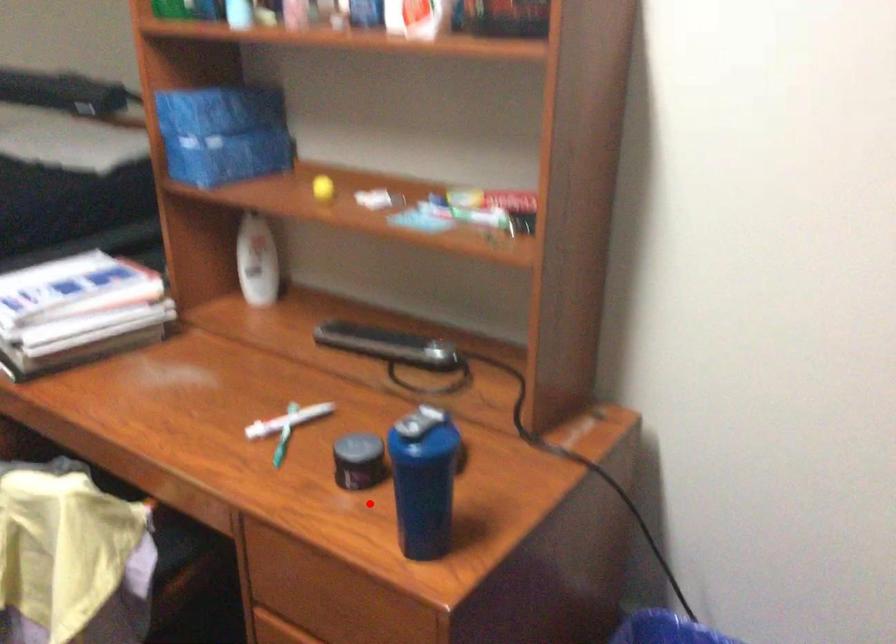
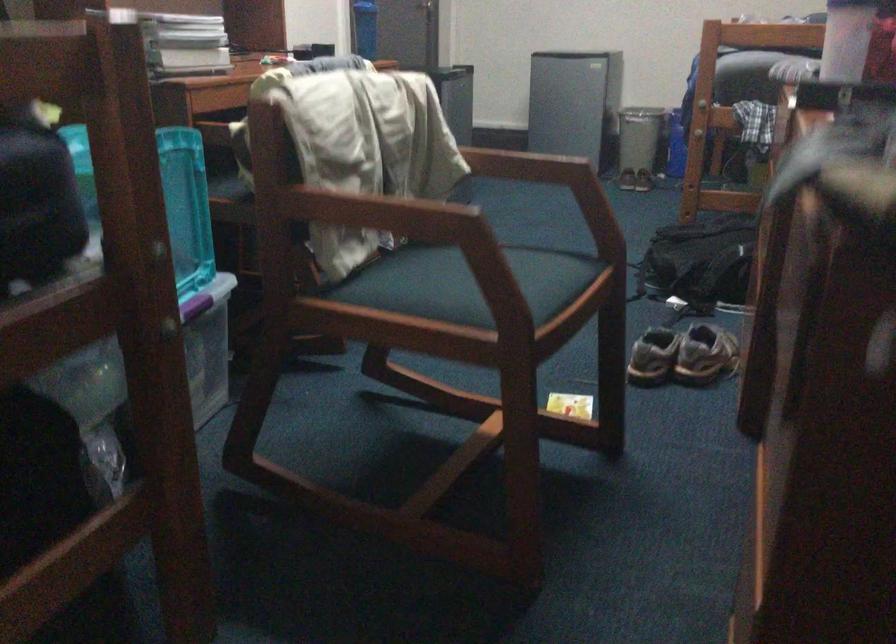
Question: A red point is marked in image1. In image2, is the corresponding 3D point closer to the camera or farther? Reply with the corresponding letter.

Choices:
 (A) The corresponding 3D point is closer.
 (B) The corresponding 3D point is farther.

Answer: (B)